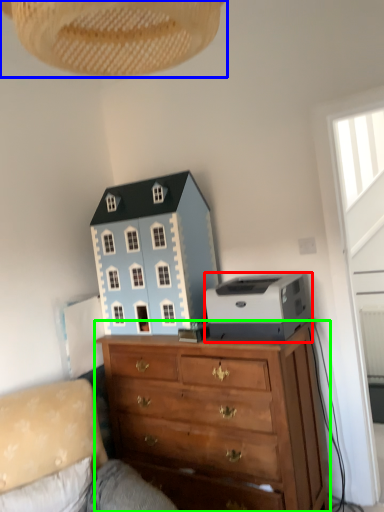
Question: Which object is the closest to the printer (highlighted by a red box)? Choose among these: lamp (highlighted by a blue box) or chest of drawers (highlighted by a green box).

Choices:
 (A) lamp
 (B) chest of drawers

Answer: (B)